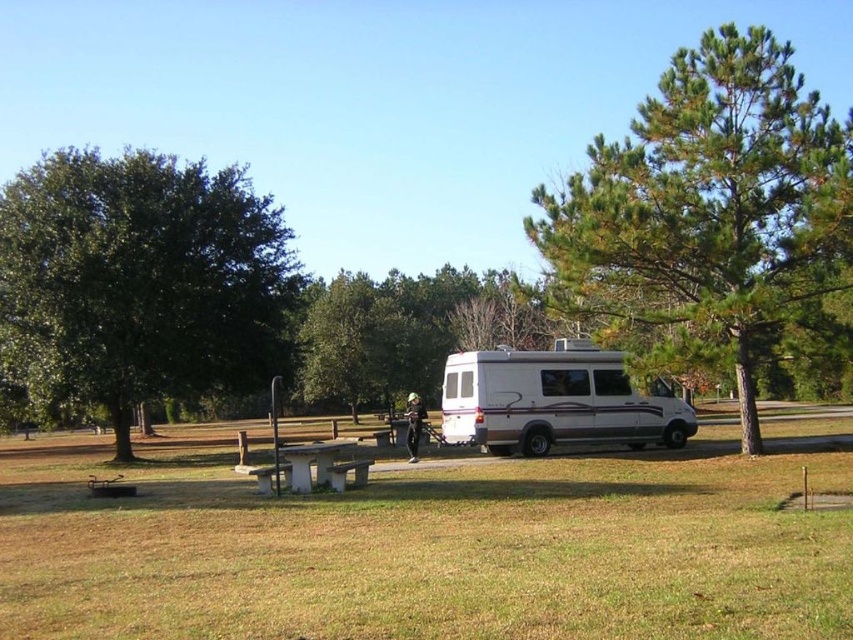
Question: Is green grass at center to the left of wooden park bench at center from the viewer's perspective?

Choices:
 (A) yes
 (B) no

Answer: (B)

Question: Which object is farther from the camera taking this photo?

Choices:
 (A) white plastic picnic table at center
 (B) green leafy tree at center

Answer: (B)

Question: Can you confirm if green leafy tree at right is smaller than wooden park bench at center?

Choices:
 (A) yes
 (B) no

Answer: (B)

Question: Does green grass at center appear under white glossy van at center?

Choices:
 (A) yes
 (B) no

Answer: (A)

Question: Which point is closer to the camera?

Choices:
 (A) (726, 264)
 (B) (144, 522)

Answer: (B)

Question: Among these objects, which one is nearest to the camera?

Choices:
 (A) white plastic picnic table at center
 (B) green leafy tree at left
 (C) white glossy van at center

Answer: (A)